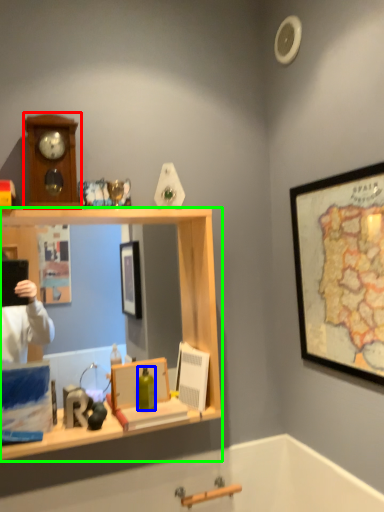
Question: Which is nearer to the clock (highlighted by a red box)? bottle (highlighted by a blue box) or desk (highlighted by a green box).

Choices:
 (A) bottle
 (B) desk

Answer: (B)